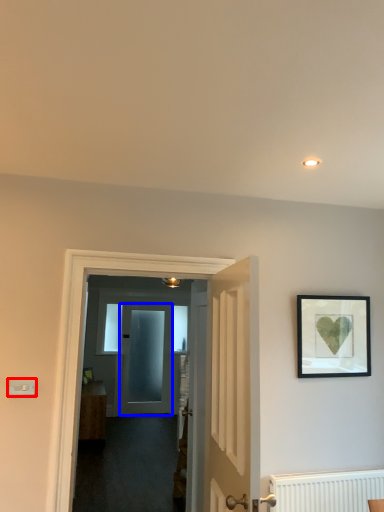
Question: Among these objects, which one is farthest to the camera, light switch (highlighted by a red box) or door (highlighted by a blue box)?

Choices:
 (A) light switch
 (B) door

Answer: (B)